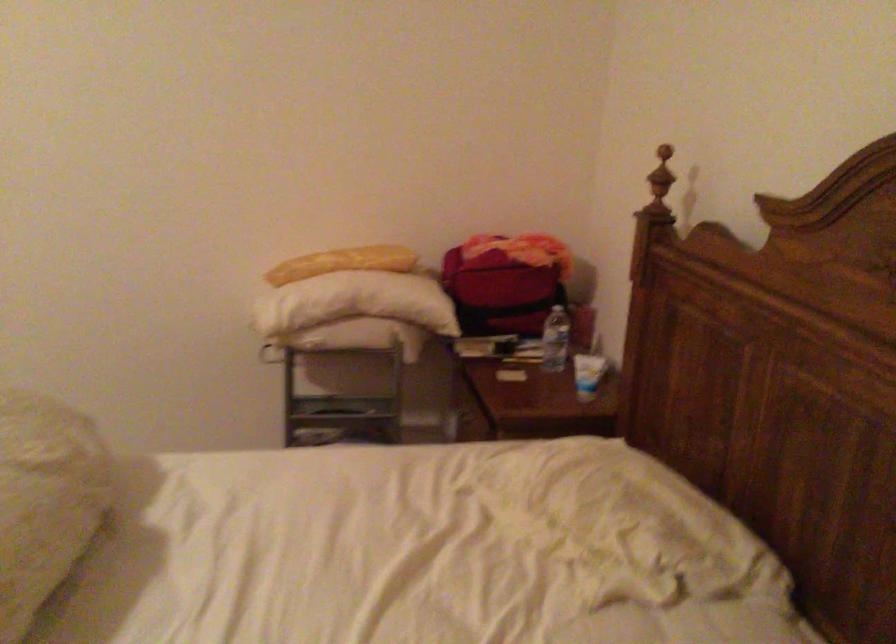
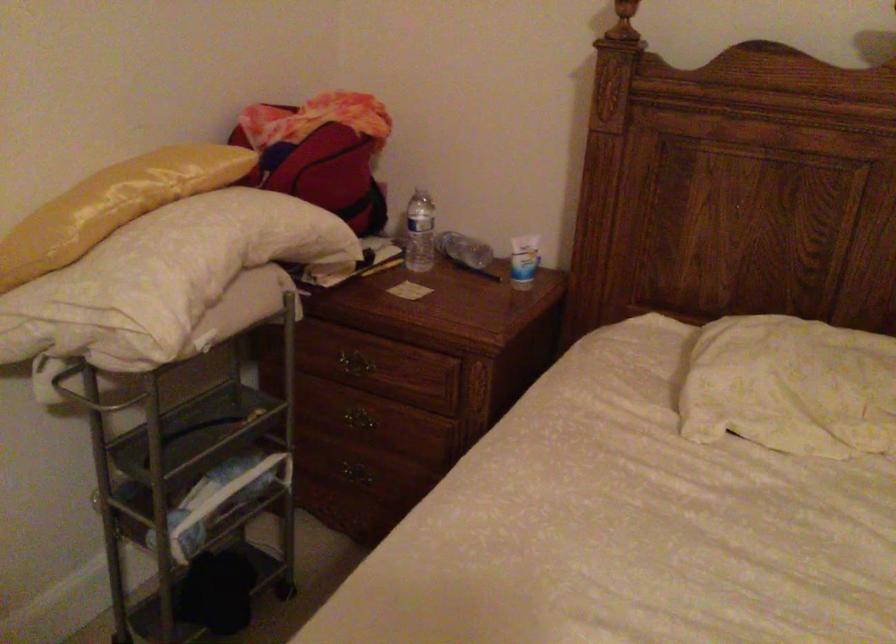
The point at (545,337) is marked in the first image. Where is the corresponding point in the second image?

(419, 232)